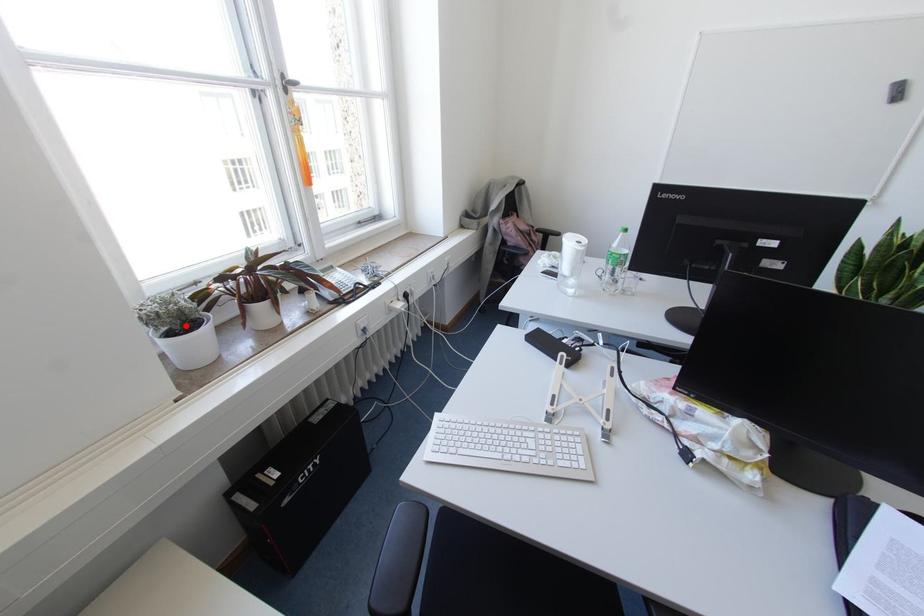
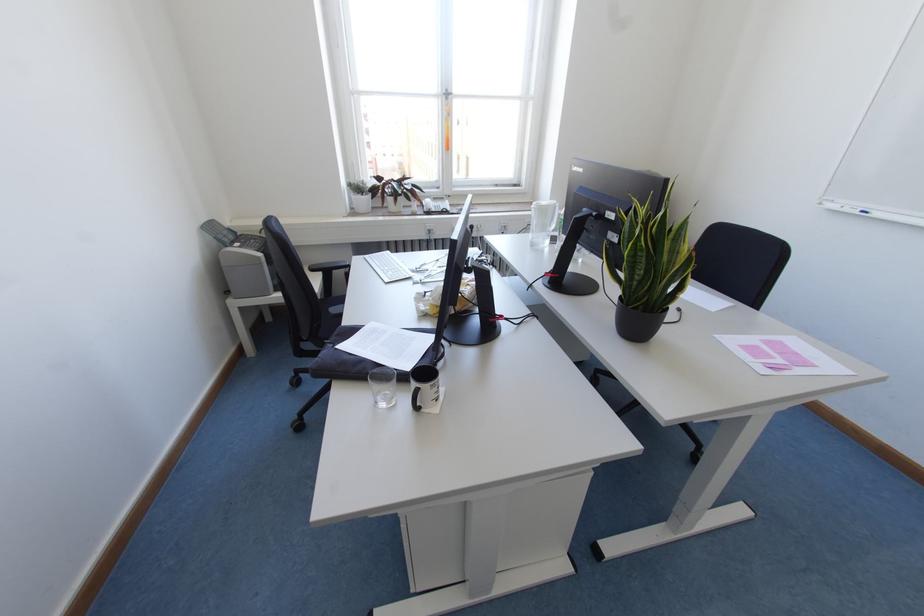
Question: I am providing you with two images of the same scene from different viewpoints. Given a red point in image1, look at the same physical point in image2. Is it:

Choices:
 (A) Closer to the viewpoint
 (B) Farther from the viewpoint

Answer: (A)